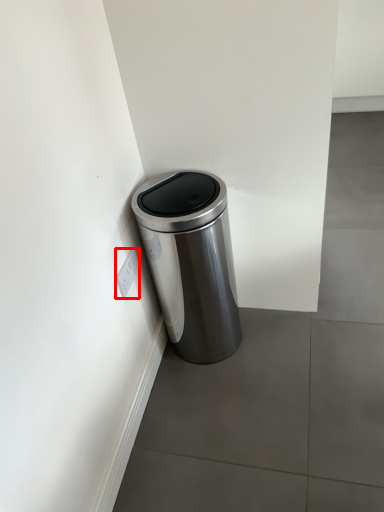
Question: From the image's perspective, considering the relative positions of electric outlet (annotated by the red box) and waste container in the image provided, where is electric outlet (annotated by the red box) located with respect to the staircase?

Choices:
 (A) below
 (B) above

Answer: (A)